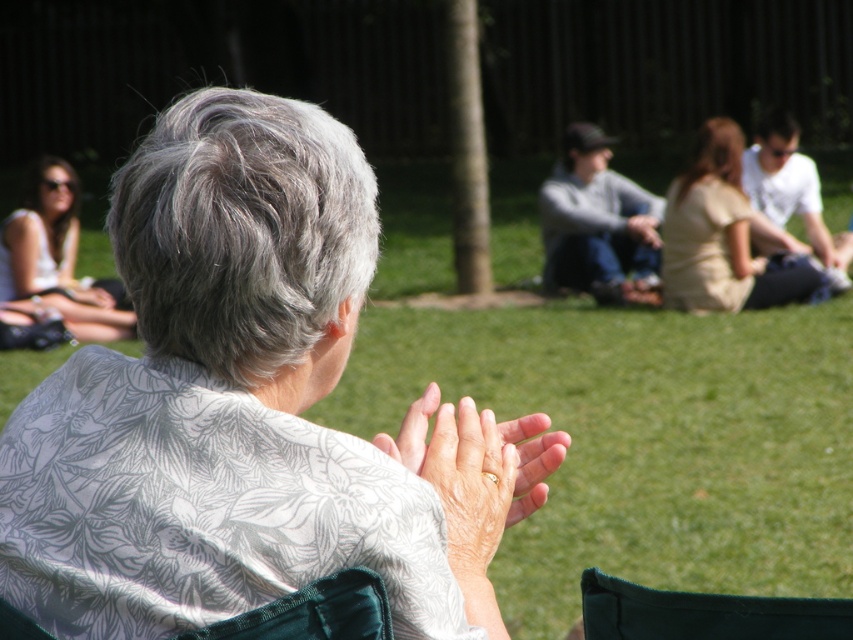
You are standing in the park and see two people wearing a beige fabric dress at center and a gray cotton sweater at center. Which one is closer to you?

The beige fabric dress at center is closer to the viewer than the gray cotton sweater at center.

You are a photographer trying to capture both the gray cotton sweater at center and the matte white shirt at upper left in a single shot. Based on their positions, which one should you focus on first to ensure both are in frame?

You should focus on the gray cotton sweater at center first because it is positioned to the right of the matte white shirt at upper left, so adjusting the camera to include both would require framing from the leftmost point of the matte white shirt at upper left to the rightmost point of the gray cotton sweater at center.